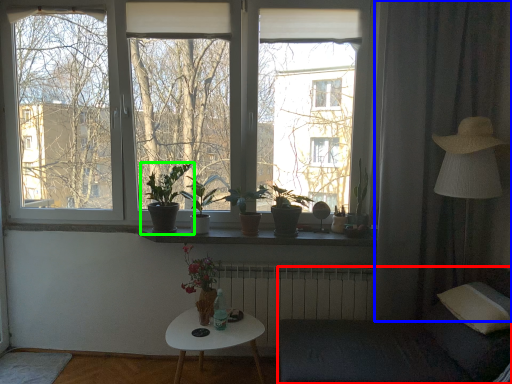
Question: Estimate the real-world distances between objects in this image. Which object is farther from armchair (highlighted by a red box), curtain (highlighted by a blue box) or houseplant (highlighted by a green box)?

Choices:
 (A) curtain
 (B) houseplant

Answer: (B)